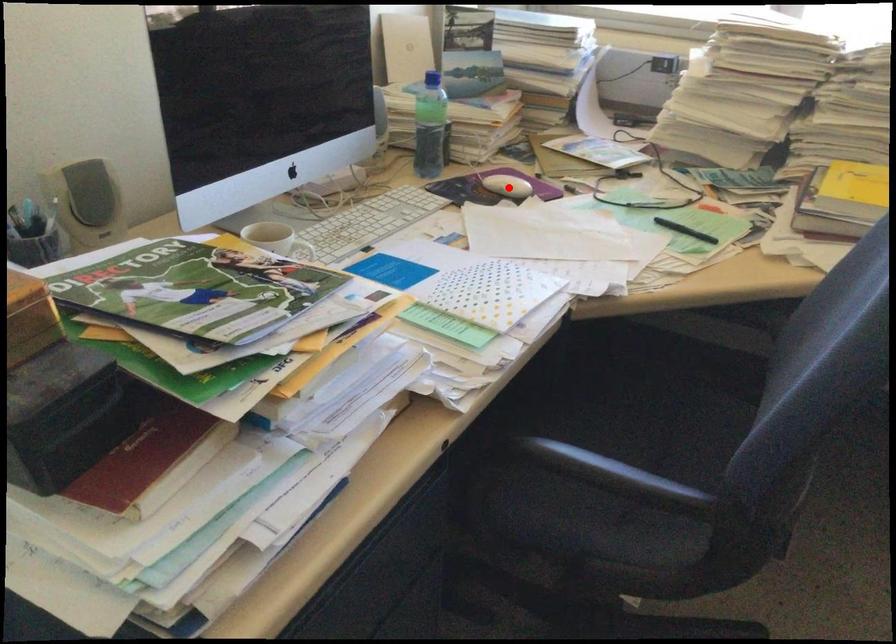
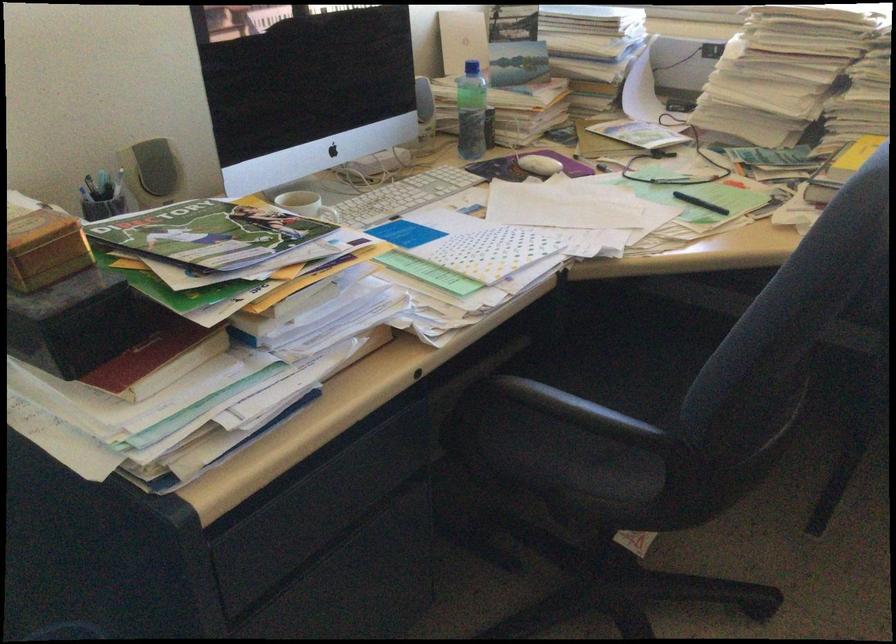
The point at the highlighted location is marked in the first image. Where is the corresponding point in the second image?

(538, 165)